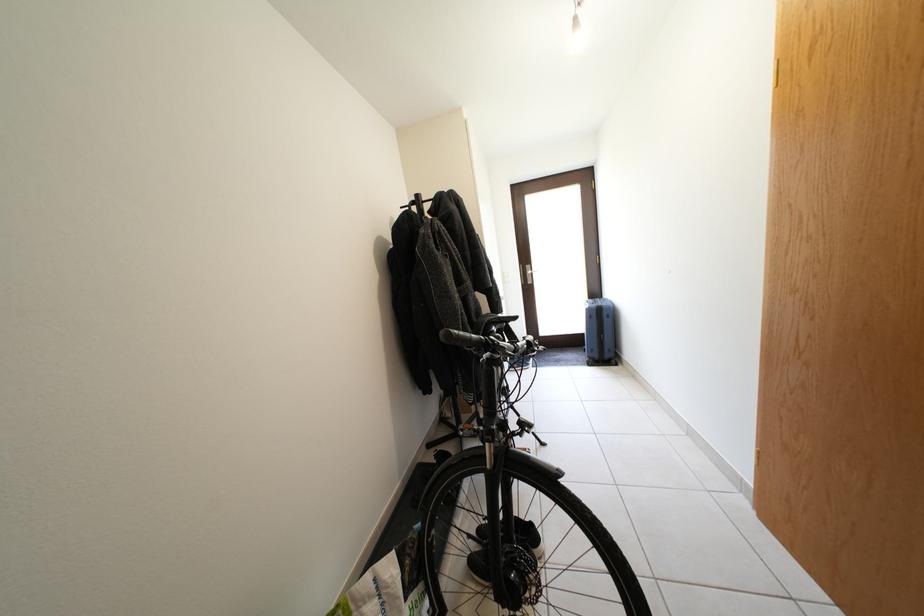
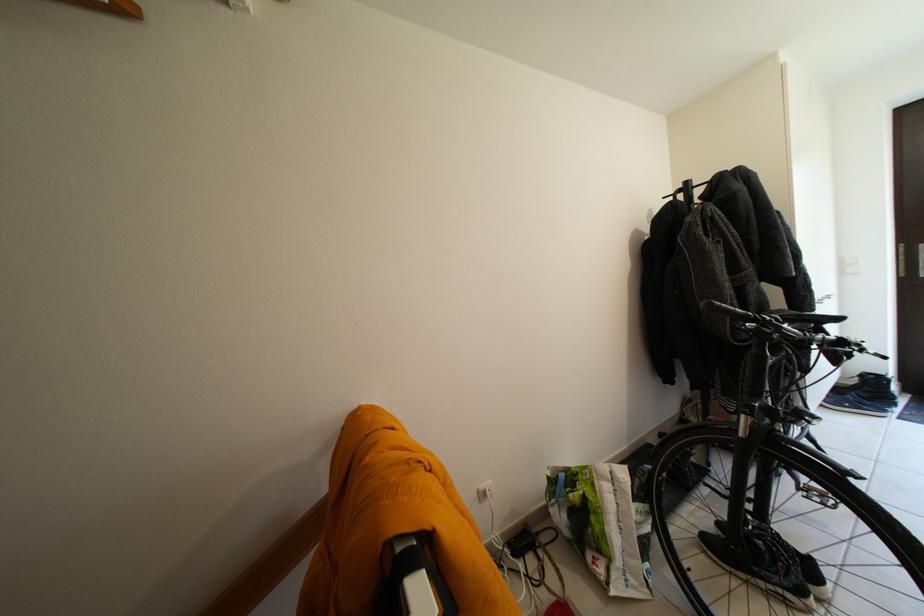
In the second image, find the point that corresponds to [537,347] in the first image.

(849, 344)